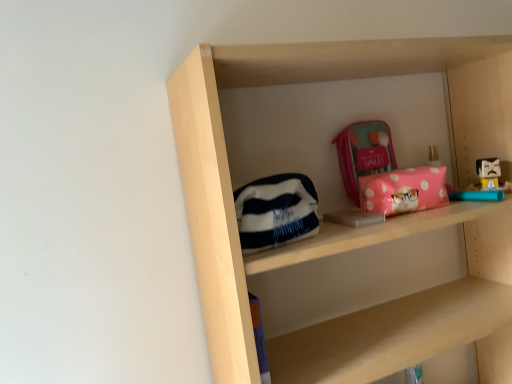
Measure the distance between point (440, 168) and camera.

Point (440, 168) and camera are 1.08 meters apart from each other.

This screenshot has height=384, width=512. Find the location of `pink polka dot pouch at center`. pink polka dot pouch at center is located at coordinates (404, 190).

Can you confirm if white fleece pouch at center, which appears as the 2th pouch when viewed from the right, is positioned to the left of pink polka dot pouch at center?

Correct, you'll find white fleece pouch at center, which appears as the 2th pouch when viewed from the right, to the left of pink polka dot pouch at center.

Considering the sizes of objects white fleece pouch at center, which appears as the first pouch when viewed from the left, and pink polka dot pouch at center in the image provided, who is wider, white fleece pouch at center, which appears as the first pouch when viewed from the left, or pink polka dot pouch at center?

pink polka dot pouch at center.

Is white fleece pouch at center, acting as the first pouch starting from the front, facing towards pink polka dot pouch at center?

No, white fleece pouch at center, acting as the first pouch starting from the front, is not turned towards pink polka dot pouch at center.

Consider the image. Is matte pink pouch at upper center, marked as the 2th pouch in a left-to-right arrangement, next to white fleece pouch at center, which ranks as the 2th pouch in top-to-bottom order, and touching it?

They are not placed beside each other.

Considering the relative positions of matte pink pouch at upper center, the 2th pouch positioned from the bottom, and white fleece pouch at center, acting as the first pouch starting from the front, in the image provided, is matte pink pouch at upper center, the 2th pouch positioned from the bottom, to the left or to the right of white fleece pouch at center, acting as the first pouch starting from the front,?

From the image, it's evident that matte pink pouch at upper center, the 2th pouch positioned from the bottom, is to the right of white fleece pouch at center, acting as the first pouch starting from the front.

Consider the image. Between matte pink pouch at upper center, the 1th pouch positioned from the back, and white fleece pouch at center, which appears as the first pouch when viewed from the left, which one has larger width?

white fleece pouch at center, which appears as the first pouch when viewed from the left, is wider.

From the image's perspective, between matte pink pouch at upper center, the 1th pouch positioned from the back, and white fleece pouch at center, marked as the 2th pouch in a back-to-front arrangement, who is located below?

white fleece pouch at center, marked as the 2th pouch in a back-to-front arrangement.

Based on the photo, considering the sizes of objects pink polka dot pouch at center and white fleece pouch at center, which appears as the 2th pouch when viewed from the right, in the image provided, who is taller, pink polka dot pouch at center or white fleece pouch at center, which appears as the 2th pouch when viewed from the right,?

white fleece pouch at center, which appears as the 2th pouch when viewed from the right, is taller.

How distant is pink polka dot pouch at center from white fleece pouch at center, the first pouch in the bottom-to-top sequence?

9.08 inches.

In the scene shown: Could you tell me if pink polka dot pouch at center is turned towards white fleece pouch at center, the first pouch in the bottom-to-top sequence?

No, pink polka dot pouch at center is not oriented towards white fleece pouch at center, the first pouch in the bottom-to-top sequence.

How different are the orientations of pink polka dot pouch at center and white fleece pouch at center, the first pouch in the bottom-to-top sequence, in degrees?

13.2 degrees.

What's the angular difference between white fleece pouch at center, which appears as the 2th pouch when viewed from the right, and matte pink pouch at upper center, marked as the 2th pouch in a left-to-right arrangement,'s facing directions?

white fleece pouch at center, which appears as the 2th pouch when viewed from the right, and matte pink pouch at upper center, marked as the 2th pouch in a left-to-right arrangement, are facing 8.2 degrees away from each other.

Looking at this image, does white fleece pouch at center, the first pouch in the bottom-to-top sequence, appear on the right side of matte pink pouch at upper center, marked as the 2th pouch in a left-to-right arrangement?

Incorrect, white fleece pouch at center, the first pouch in the bottom-to-top sequence, is not on the right side of matte pink pouch at upper center, marked as the 2th pouch in a left-to-right arrangement.

Who is shorter, white fleece pouch at center, the first pouch in the bottom-to-top sequence, or matte pink pouch at upper center, the 1th pouch positioned from the back?

matte pink pouch at upper center, the 1th pouch positioned from the back.

From a real-world perspective, is white fleece pouch at center, the first pouch in the bottom-to-top sequence, above or below matte pink pouch at upper center, the 1th pouch positioned from the back?

In terms of real-world spatial position, white fleece pouch at center, the first pouch in the bottom-to-top sequence, is below matte pink pouch at upper center, the 1th pouch positioned from the back.

Based on the photo, is pink polka dot pouch at center in contact with matte pink pouch at upper center, which is the first pouch from top to bottom?

There is a gap between pink polka dot pouch at center and matte pink pouch at upper center, which is the first pouch from top to bottom.

The image size is (512, 384). Find the location of `package below the matte pink pouch at upper center, arranged as the first pouch when viewed from the right (from a real-world perspective)`. package below the matte pink pouch at upper center, arranged as the first pouch when viewed from the right (from a real-world perspective) is located at coordinates (404, 190).

Does pink polka dot pouch at center come in front of matte pink pouch at upper center, marked as the 2th pouch in a left-to-right arrangement?

Yes, pink polka dot pouch at center is closer to the camera.

Does point (364, 155) come in front of point (396, 200)?

No, (364, 155) is behind (396, 200).

Considering the sizes of objects matte pink pouch at upper center, placed as the 2th pouch when sorted from front to back, and pink polka dot pouch at center in the image provided, who is thinner, matte pink pouch at upper center, placed as the 2th pouch when sorted from front to back, or pink polka dot pouch at center?

Thinner between the two is matte pink pouch at upper center, placed as the 2th pouch when sorted from front to back.

Is matte pink pouch at upper center, the 2th pouch positioned from the bottom, not close to pink polka dot pouch at center?

No, matte pink pouch at upper center, the 2th pouch positioned from the bottom, is in close proximity to pink polka dot pouch at center.

Can you confirm if matte pink pouch at upper center, the 2th pouch positioned from the bottom, is shorter than pink polka dot pouch at center?

In fact, matte pink pouch at upper center, the 2th pouch positioned from the bottom, may be taller than pink polka dot pouch at center.

Which pouch is the 2nd one when counting from the left side of the pink polka dot pouch at center? Please provide its 2D coordinates.

[(276, 211)]

The width and height of the screenshot is (512, 384). What are the coordinates of `pouch located on the right of white fleece pouch at center, which appears as the first pouch when viewed from the left` in the screenshot? It's located at (364, 153).

Considering their positions, is pink polka dot pouch at center positioned further to white fleece pouch at center, which appears as the first pouch when viewed from the left, than matte pink pouch at upper center, placed as the 2th pouch when sorted from front to back?

matte pink pouch at upper center, placed as the 2th pouch when sorted from front to back, is further to white fleece pouch at center, which appears as the first pouch when viewed from the left.

Estimate the real-world distances between objects in this image. Which object is further from white fleece pouch at center, the first pouch in the bottom-to-top sequence, matte pink pouch at upper center, arranged as the first pouch when viewed from the right, or pink polka dot pouch at center?

matte pink pouch at upper center, arranged as the first pouch when viewed from the right.

Estimate the real-world distances between objects in this image. Which object is further from matte pink pouch at upper center, which is the first pouch from top to bottom, white fleece pouch at center, the first pouch in the bottom-to-top sequence, or pink polka dot pouch at center?

white fleece pouch at center, the first pouch in the bottom-to-top sequence, is positioned further to the anchor matte pink pouch at upper center, which is the first pouch from top to bottom.

From the image, which object appears to be farther from matte pink pouch at upper center, placed as the 2th pouch when sorted from front to back, pink polka dot pouch at center or white fleece pouch at center, marked as the 2th pouch in a back-to-front arrangement?

white fleece pouch at center, marked as the 2th pouch in a back-to-front arrangement, is positioned further to the anchor matte pink pouch at upper center, placed as the 2th pouch when sorted from front to back.

Based on their spatial positions, is matte pink pouch at upper center, placed as the 2th pouch when sorted from front to back, or white fleece pouch at center, which appears as the 2th pouch when viewed from the right, closer to pink polka dot pouch at center?

matte pink pouch at upper center, placed as the 2th pouch when sorted from front to back, is positioned closer to the anchor pink polka dot pouch at center.

Based on their spatial positions, is white fleece pouch at center, acting as the first pouch starting from the front, or matte pink pouch at upper center, marked as the 2th pouch in a left-to-right arrangement, further from pink polka dot pouch at center?

white fleece pouch at center, acting as the first pouch starting from the front, is further to pink polka dot pouch at center.

You are a GUI agent. You are given a task and a screenshot of the screen. Output one action in this format:
    pyautogui.click(x=<x>, y=<y>)
    Task: Click on the package located between white fleece pouch at center, the first pouch in the bottom-to-top sequence, and matte pink pouch at upper center, the 2th pouch positioned from the bottom, in the depth direction
    This screenshot has width=512, height=384.
    Given the screenshot: What is the action you would take?
    point(404,190)